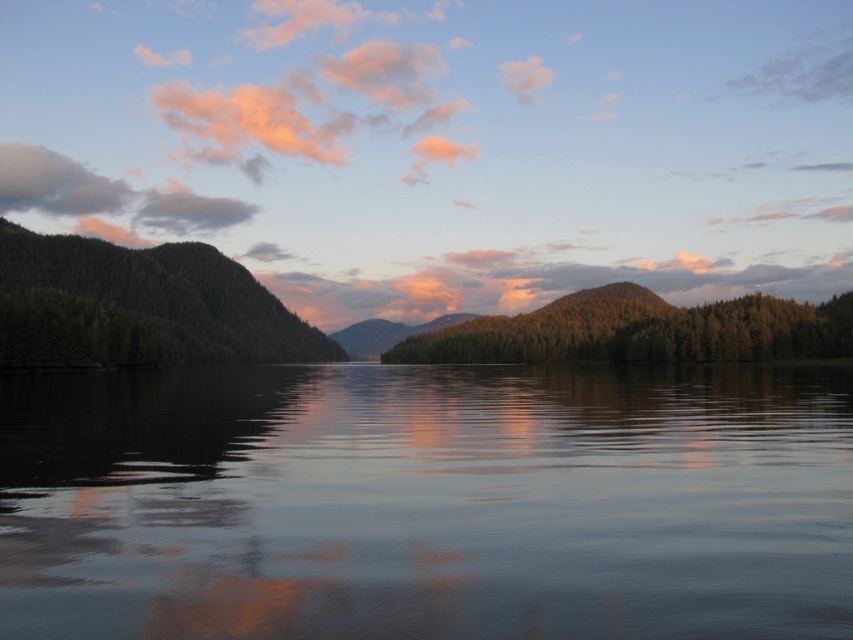
You are an artist trying to paint the scene. You notice the smooth reflective water at center and the green textured forest at center. Which object is located below the other?

The smooth reflective water at center is positioned under the green textured forest at center, so the water is below the forest.

You are standing on the lakeside and want to take a photo of the green matte forest at left and the green textured forest at center. Which forest will appear closer to you in the photo?

The green matte forest at left will appear closer to you in the photo because it is positioned in front of the green textured forest at center.